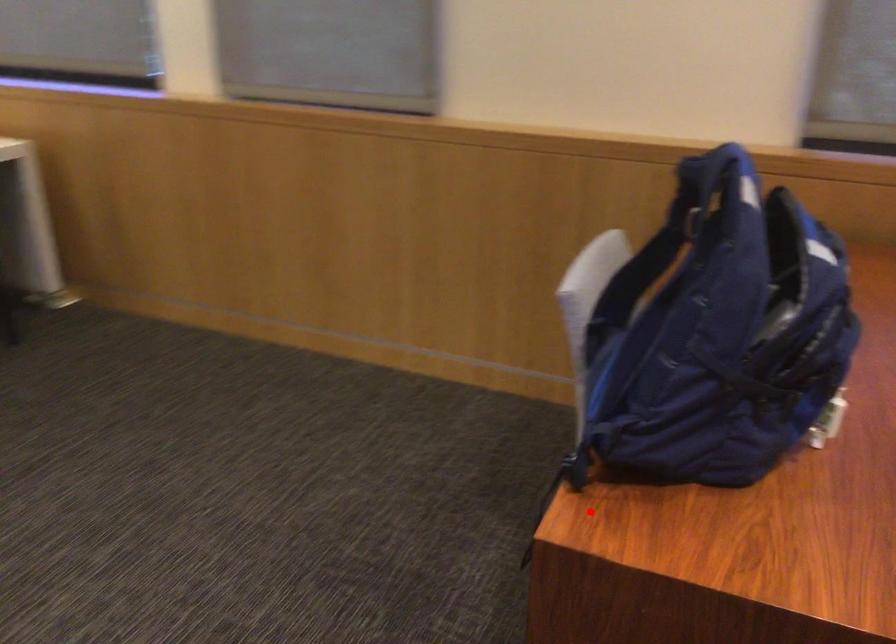
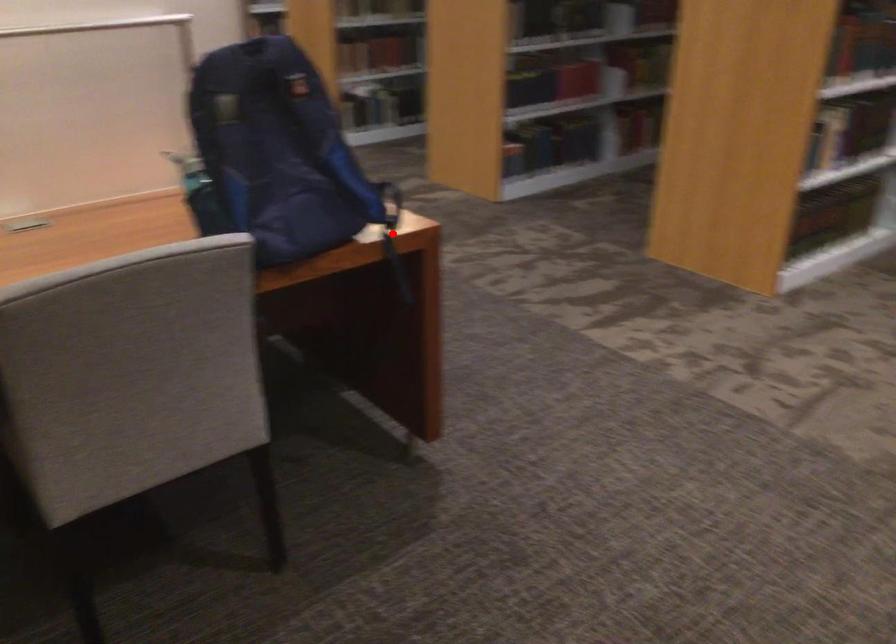
I am providing you with two images of the same scene from different viewpoints. A red point is marked on the first image and another point is marked on the second image. Do the highlighted points in image1 and image2 indicate the same real-world spot?

Yes